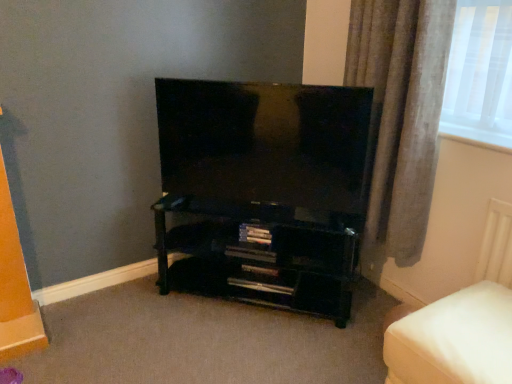
Where is `space that is in front of black glossy shelf at lower center`? space that is in front of black glossy shelf at lower center is located at coordinates (248, 342).